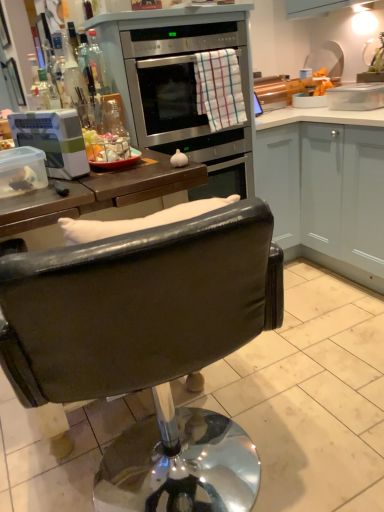
Identify the location of vacant space to the right of black leather chair at center. (317, 418).